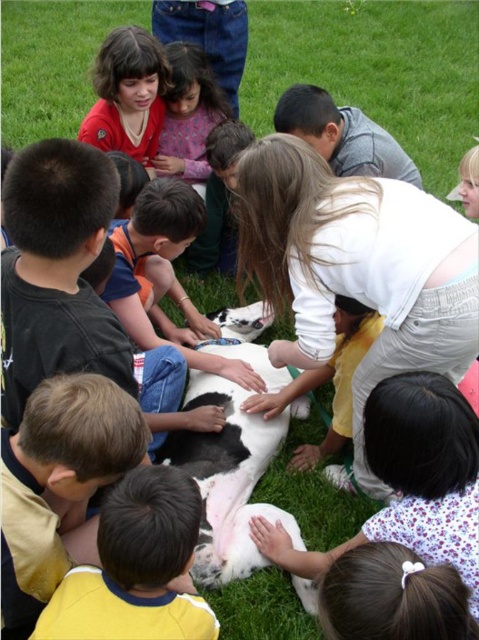
Does smooth yellow shirt at lower left have a lesser height compared to smooth pink shirt at center?

Correct, smooth yellow shirt at lower left is not as tall as smooth pink shirt at center.

Looking at this image, which is more to the right, smooth yellow shirt at lower left or smooth pink shirt at center?

Positioned to the right is smooth pink shirt at center.

Is point (50, 561) farther from viewer compared to point (169, 48)?

No, (50, 561) is closer to viewer.

I want to click on smooth yellow shirt at lower left, so click(x=57, y=481).

Does smooth yellow shirt at lower left lie behind yellow jersey at lower left?

Yes, it is behind yellow jersey at lower left.

Does point (2, 518) come behind point (124, 508)?

Yes.

Image resolution: width=479 pixels, height=640 pixels. What do you see at coordinates (57, 481) in the screenshot?
I see `smooth yellow shirt at lower left` at bounding box center [57, 481].

At what (x,y) coordinates should I click in order to perform the action: click on smooth yellow shirt at lower left. Please return your answer as a coordinate pair (x, y). The height and width of the screenshot is (640, 479). Looking at the image, I should click on (57, 481).

Is matte red shirt at upper left to the left of smooth pink shirt at center from the viewer's perspective?

Indeed, matte red shirt at upper left is positioned on the left side of smooth pink shirt at center.

Based on the photo, is matte red shirt at upper left to the right of smooth pink shirt at center from the viewer's perspective?

No, matte red shirt at upper left is not to the right of smooth pink shirt at center.

The height and width of the screenshot is (640, 479). In order to click on matte red shirt at upper left in this screenshot , I will do `click(127, 93)`.